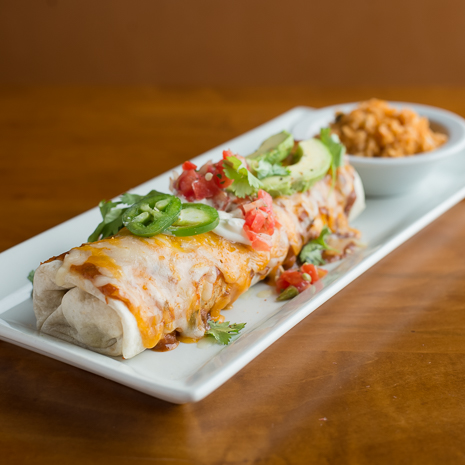
Find the location of a particular element. white ceramic bowl is located at coordinates (401, 172).